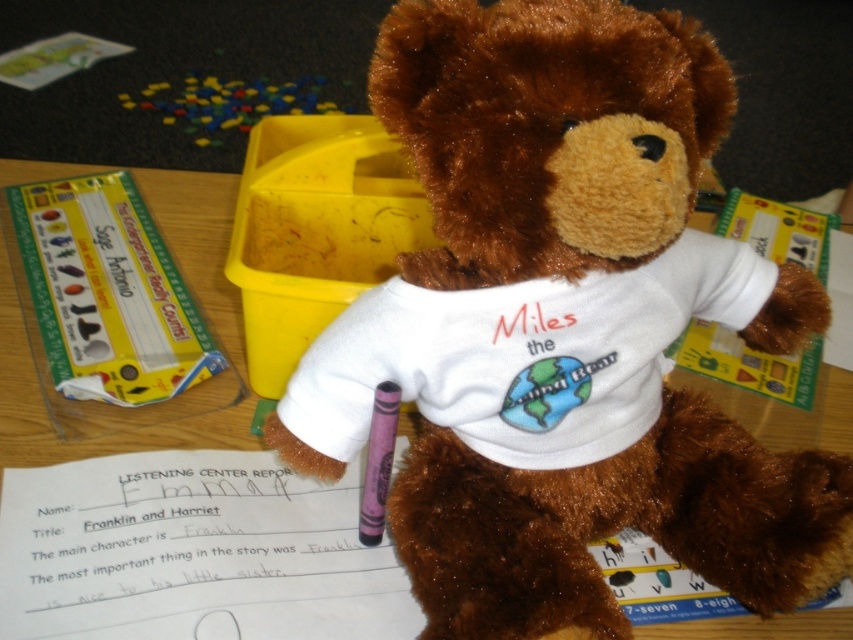
Question: Is the position of white cotton t-shirt at center less distant than that of white paper at center?

Choices:
 (A) yes
 (B) no

Answer: (A)

Question: Which of these objects is positioned farthest from the purple wax crayon at center?

Choices:
 (A) brown plush teddy bear at center
 (B) white paper at center
 (C) white cotton t-shirt at center

Answer: (A)

Question: Can you confirm if white cotton t-shirt at center is smaller than purple wax crayon at center?

Choices:
 (A) yes
 (B) no

Answer: (B)

Question: Which point is closer to the camera?

Choices:
 (A) 285,564
 (B) 583,484

Answer: (B)

Question: Observing the image, what is the correct spatial positioning of white cotton t-shirt at center in reference to white paper at center?

Choices:
 (A) below
 (B) above

Answer: (B)

Question: Which of the following is the closest to the observer?

Choices:
 (A) purple wax crayon at center
 (B) brown plush teddy bear at center

Answer: (B)